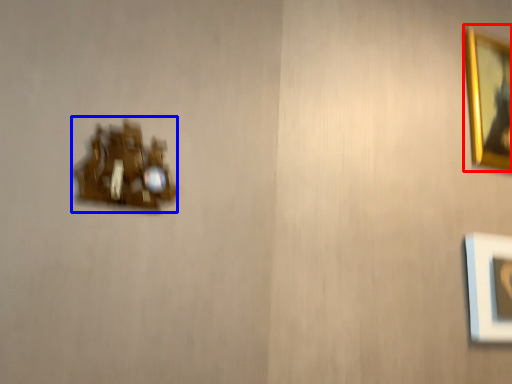
Question: Among these objects, which one is nearest to the camera, picture frame (highlighted by a red box) or portrait (highlighted by a blue box)?

Choices:
 (A) picture frame
 (B) portrait

Answer: (B)